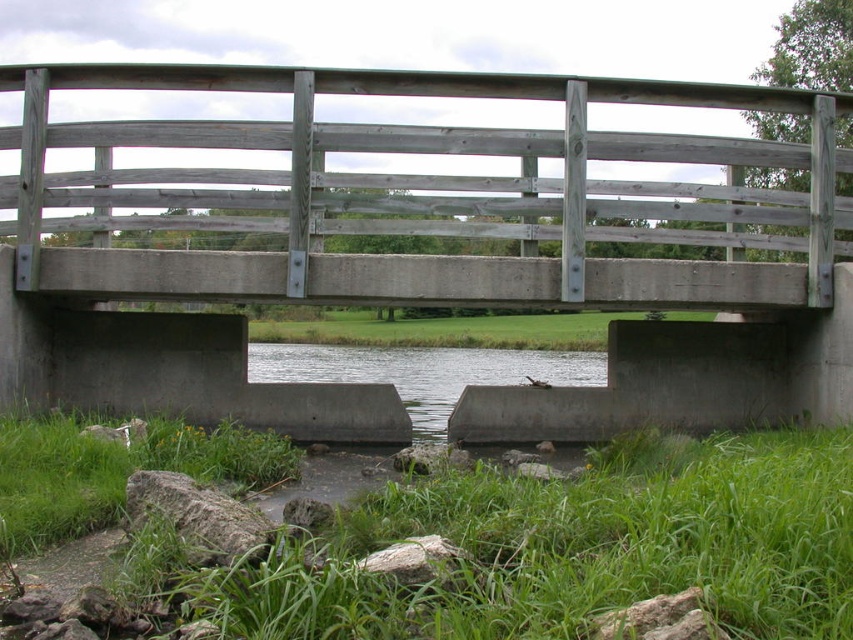
You are a landscape architect designing a new park. You have to decide where to place a new walking path. The path must be placed on the object that takes up more space in the scene. Which object should you choose between the gray concrete stream at center and the green grass at center?

The green grass at center occupies more space than the gray concrete stream at center, so the walking path should be placed on the green grass at center.

You are a gardener who wants to plant flowers between the gray concrete stream at center and the green grass at center. Which area is taller so that the flowers can grow better?

The green grass at center is taller than the gray concrete stream at center, so planting flowers in the green grass at center would be better for their growth.

You are a maintenance worker needing to cross the gray wooden bridge at center to reach the green grass at lower left for inspection. The safety regulations state that the distance between the bridge and the grass must be less than 6 meters to proceed safely. Can you proceed?

The distance between the gray wooden bridge at center and the green grass at lower left is 5.70 meters, which is less than the 6 meters required by safety regulations. Therefore, you can proceed safely.